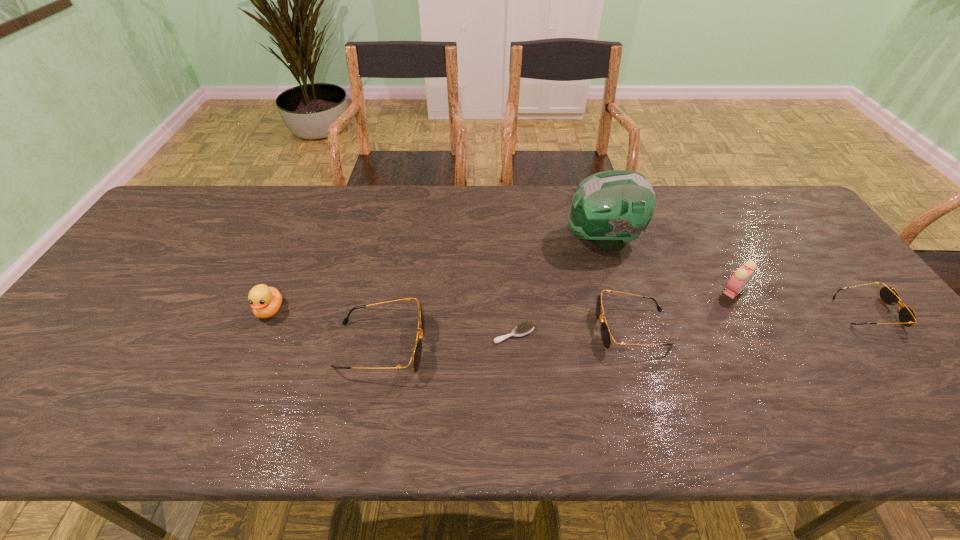
The sunglassess are evenly distributed in the image. To maintain this, where would you place another sunglasses on the left? Please point to a free space. Please provide its 2D coordinates. Your answer should be formatted as a tuple, i.e. [(x, y)], where the tuple contains the x and y coordinates of a point satisfying the conditions above.

[(112, 365)]